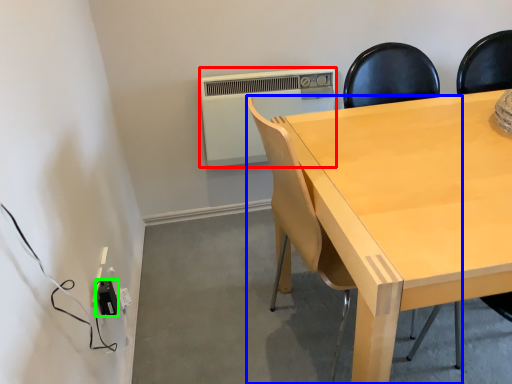
Question: Estimate the real-world distances between objects in this image. Which object is farther from air conditioning (highlighted by a red box), chair (highlighted by a blue box) or electric outlet (highlighted by a green box)?

Choices:
 (A) chair
 (B) electric outlet

Answer: (B)